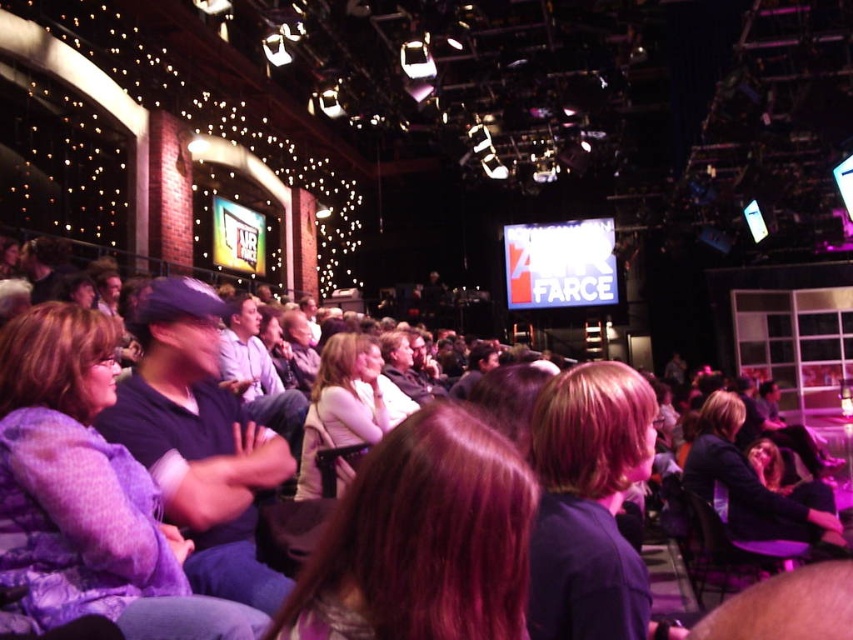
Question: Is smooth brown hair at center to the left of light blue shirt at center from the viewer's perspective?

Choices:
 (A) yes
 (B) no

Answer: (B)

Question: Which point is closer to the camera?

Choices:
 (A) (6, 493)
 (B) (509, 502)

Answer: (B)

Question: Which of these objects is positioned farthest from the dark blue sweater at center?

Choices:
 (A) dark purple shirt at center
 (B) purple fuzzy coat at left

Answer: (B)

Question: Which point is closer to the camera?

Choices:
 (A) dark blue sweater at center
 (B) dark purple shirt at center

Answer: (B)

Question: Is smooth brown hair at center thinner than light blue shirt at center?

Choices:
 (A) no
 (B) yes

Answer: (B)

Question: Does dark blue sweater at center have a smaller size compared to light blue shirt at center?

Choices:
 (A) yes
 (B) no

Answer: (A)